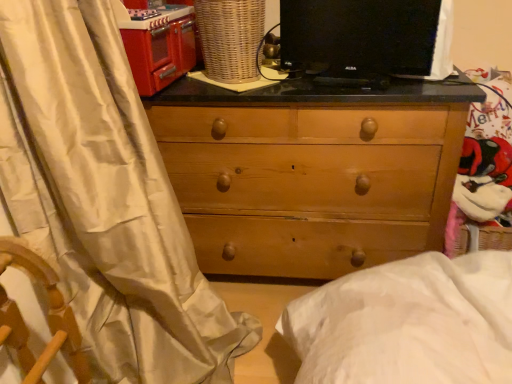
Question: From their relative heights in the image, would you say natural wood chest of drawers at center is taller or shorter than shiny red oven at upper left?

Choices:
 (A) tall
 (B) short

Answer: (A)

Question: In the image, is natural wood chest of drawers at center positioned in front of or behind shiny red oven at upper left?

Choices:
 (A) front
 (B) behind

Answer: (B)

Question: Considering the real-world distances, which object is closest to the shiny red oven at upper left?

Choices:
 (A) white satin curtain at left
 (B) natural wood chest of drawers at center
 (C) black glossy monitor at upper center
 (D) woven brown basket at upper center

Answer: (D)

Question: Estimate the real-world distances between objects in this image. Which object is farther from the woven brown basket at upper center?

Choices:
 (A) white satin curtain at left
 (B) shiny red oven at upper left
 (C) natural wood chest of drawers at center
 (D) black glossy monitor at upper center

Answer: (A)